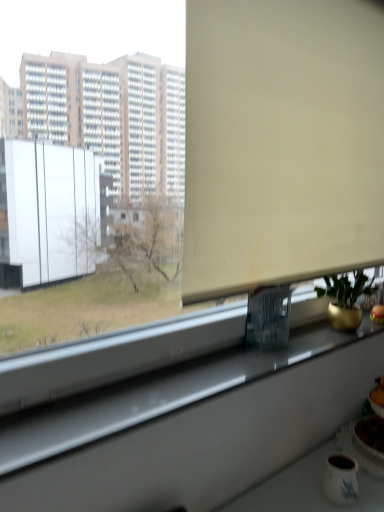
Question: Is white glossy window sill at lower center positioned before beige matte window screen at upper center?

Choices:
 (A) yes
 (B) no

Answer: (A)

Question: From the image's perspective, is white glossy window sill at lower center under beige matte window screen at upper center?

Choices:
 (A) yes
 (B) no

Answer: (A)

Question: Does white glossy window sill at lower center come behind beige matte window screen at upper center?

Choices:
 (A) no
 (B) yes

Answer: (A)

Question: Can you confirm if white glossy window sill at lower center is positioned to the left of beige matte window screen at upper center?

Choices:
 (A) yes
 (B) no

Answer: (A)

Question: Can you confirm if white glossy window sill at lower center is positioned to the right of beige matte window screen at upper center?

Choices:
 (A) yes
 (B) no

Answer: (B)

Question: Is matte white mug at lower right wider or thinner than beige matte window screen at upper center?

Choices:
 (A) wide
 (B) thin

Answer: (A)

Question: From a real-world perspective, is matte white mug at lower right physically located above or below beige matte window screen at upper center?

Choices:
 (A) below
 (B) above

Answer: (A)

Question: Looking at the image, does matte white mug at lower right seem bigger or smaller compared to beige matte window screen at upper center?

Choices:
 (A) big
 (B) small

Answer: (B)

Question: Is point click(337, 474) closer or farther from the camera than point click(198, 74)?

Choices:
 (A) closer
 (B) farther

Answer: (B)

Question: From the image's perspective, is beige matte window screen at upper center positioned above or below matte white mug at lower right?

Choices:
 (A) above
 (B) below

Answer: (A)

Question: Looking at their shapes, would you say beige matte window screen at upper center is wider or thinner than matte white mug at lower right?

Choices:
 (A) wide
 (B) thin

Answer: (B)

Question: Is beige matte window screen at upper center in front of or behind matte white mug at lower right in the image?

Choices:
 (A) front
 (B) behind

Answer: (A)

Question: Considering the positions of beige matte window screen at upper center and matte white mug at lower right in the image, is beige matte window screen at upper center taller or shorter than matte white mug at lower right?

Choices:
 (A) short
 (B) tall

Answer: (B)

Question: Considering the positions of point pos(354,270) and point pos(347,480), is point pos(354,270) closer or farther from the camera than point pos(347,480)?

Choices:
 (A) closer
 (B) farther

Answer: (B)

Question: In terms of width, does gold metallic pot at right look wider or thinner when compared to matte white mug at lower right?

Choices:
 (A) thin
 (B) wide

Answer: (B)